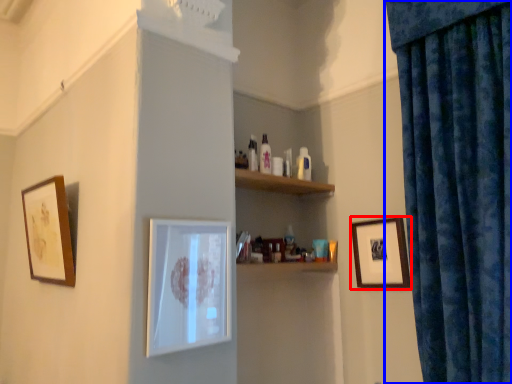
Question: Which object is further to the camera taking this photo, picture frame (highlighted by a red box) or curtain (highlighted by a blue box)?

Choices:
 (A) picture frame
 (B) curtain

Answer: (A)